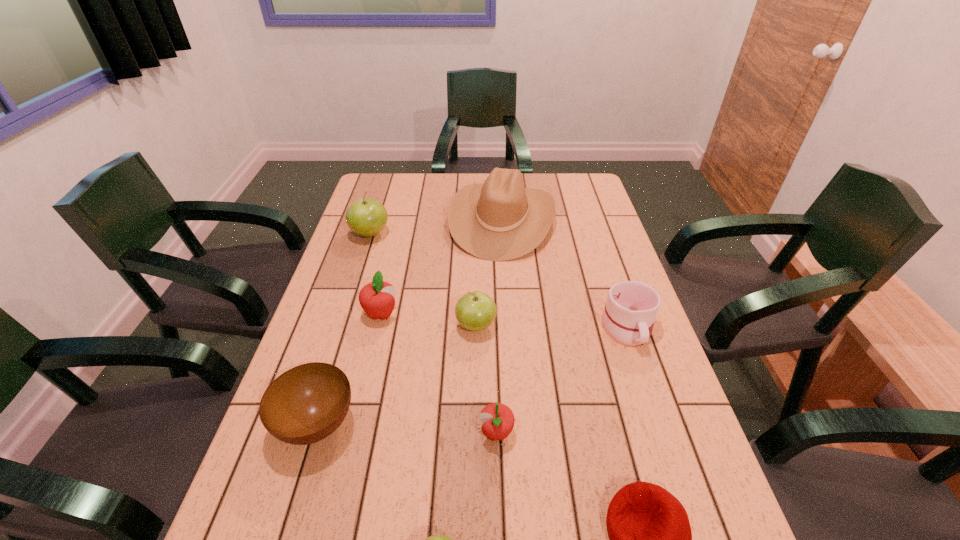
Choose which object is the second nearest neighbor to the bowl. Please provide its 2D coordinates. Your answer should be formatted as a tuple, i.e. [(x, y)], where the tuple contains the x and y coordinates of a point satisfying the conditions above.

[(439, 539)]

Find the location of a particular element. This screenshot has width=960, height=540. apple object that ranks as the closest to the white mug is located at coordinates (475, 311).

Choose which apple is the second nearest neighbor to the mug. Please provide its 2D coordinates. Your answer should be formatted as a tuple, i.e. [(x, y)], where the tuple contains the x and y coordinates of a point satisfying the conditions above.

[(498, 419)]

Locate which green apple is the third closest to the farther red apple. Please provide its 2D coordinates. Your answer should be formatted as a tuple, i.e. [(x, y)], where the tuple contains the x and y coordinates of a point satisfying the conditions above.

[(439, 539)]

Find the location of a particular element. The height and width of the screenshot is (540, 960). green apple that stands as the third closest to the brown cowboy hat is located at coordinates (439, 539).